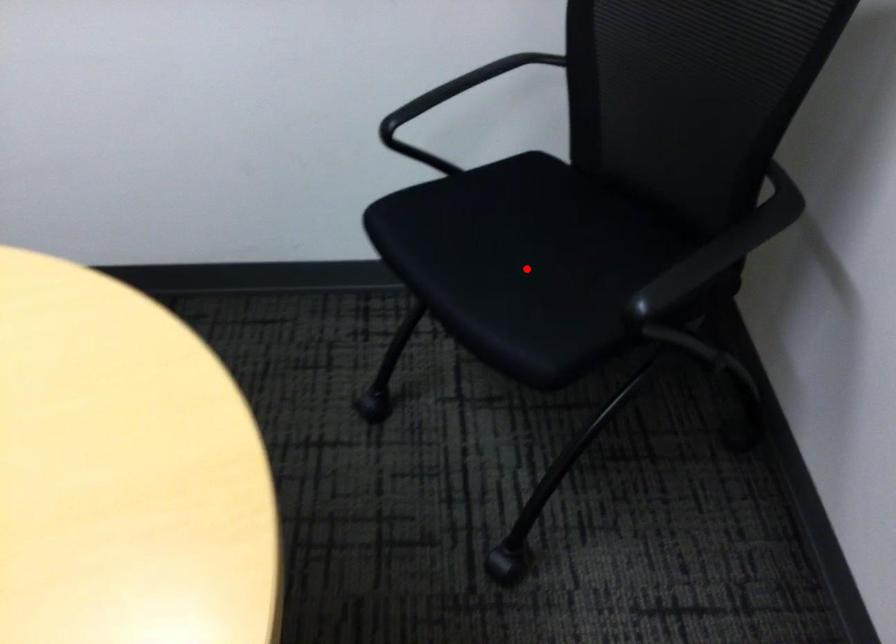
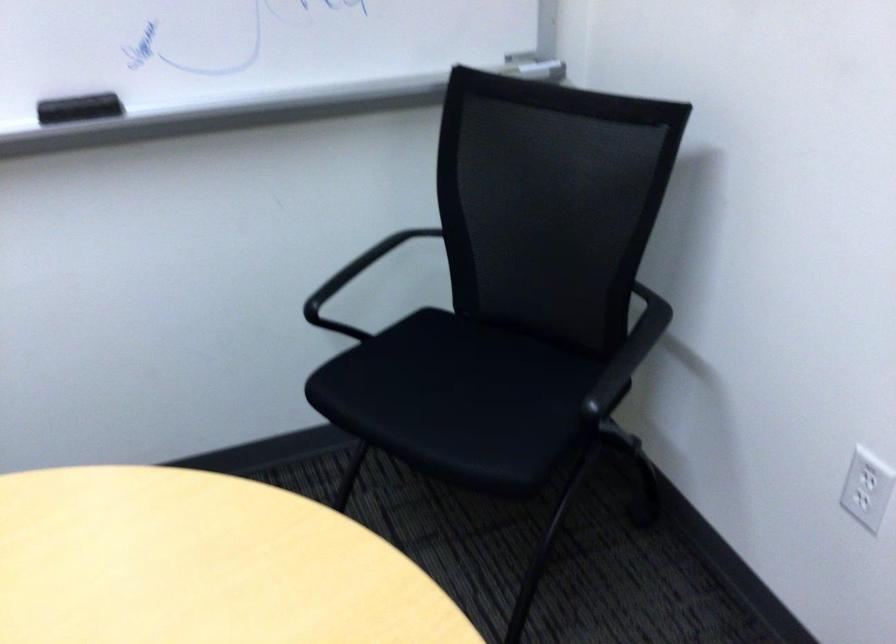
Question: I am providing you with two images of the same scene from different viewpoints. A red point is shown in image1. For the corresponding object point in image2, is it positioned nearer or farther from the camera?

Choices:
 (A) Nearer
 (B) Farther

Answer: (B)